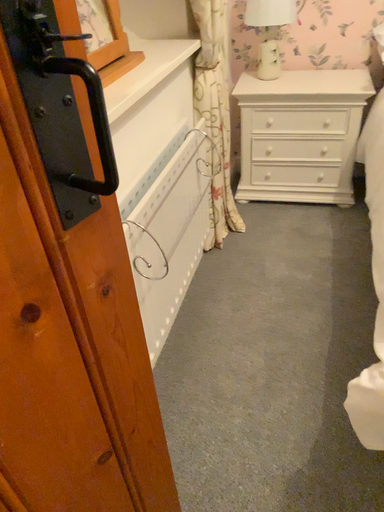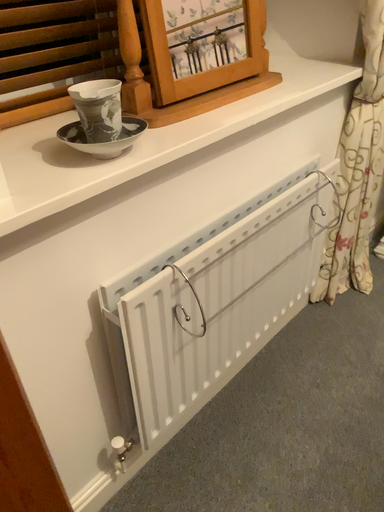
Question: How did the camera likely rotate when shooting the video?

Choices:
 (A) rotated right
 (B) rotated left

Answer: (B)